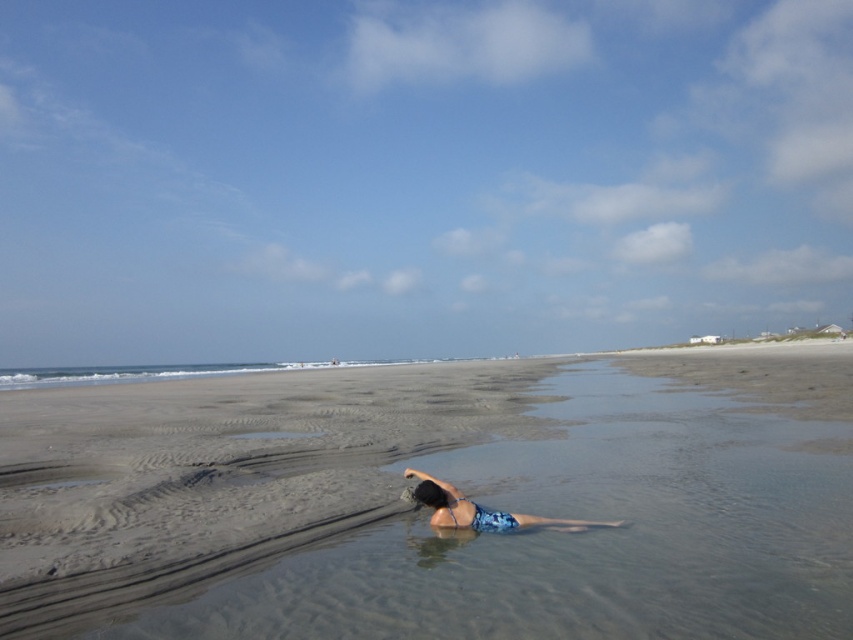
Is smooth sand at lower center further to camera compared to blue printed swimsuit at center?

No.

Is smooth sand at lower center wider than blue printed swimsuit at center?

Indeed, smooth sand at lower center has a greater width compared to blue printed swimsuit at center.

Between point (332, 579) and point (408, 476), which one is positioned in front?

Point (332, 579) is more forward.

Where is `smooth sand at lower center`? smooth sand at lower center is located at coordinates (426, 512).